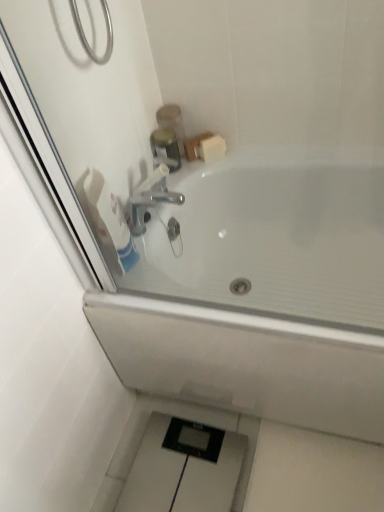
Question: Does white glossy bathtub at upper center appear on the right side of white matte toilet paper at upper left?

Choices:
 (A) no
 (B) yes

Answer: (B)

Question: Is white glossy bathtub at upper center oriented away from white matte toilet paper at upper left?

Choices:
 (A) yes
 (B) no

Answer: (B)

Question: Is white glossy bathtub at upper center outside white matte toilet paper at upper left?

Choices:
 (A) yes
 (B) no

Answer: (A)

Question: Does white glossy bathtub at upper center have a greater width compared to white matte toilet paper at upper left?

Choices:
 (A) no
 (B) yes

Answer: (B)

Question: From a real-world perspective, is white glossy bathtub at upper center positioned over white matte toilet paper at upper left based on gravity?

Choices:
 (A) yes
 (B) no

Answer: (B)

Question: Is white glossy bathtub at upper center shorter than white matte toilet paper at upper left?

Choices:
 (A) yes
 (B) no

Answer: (B)

Question: Considering the relative sizes of brushed metal faucet at upper center and white matte toilet paper at upper left in the image provided, is brushed metal faucet at upper center wider than white matte toilet paper at upper left?

Choices:
 (A) yes
 (B) no

Answer: (A)

Question: Considering the relative positions of brushed metal faucet at upper center and white matte toilet paper at upper left in the image provided, is brushed metal faucet at upper center in front of white matte toilet paper at upper left?

Choices:
 (A) no
 (B) yes

Answer: (A)

Question: Is brushed metal faucet at upper center at the left side of white matte toilet paper at upper left?

Choices:
 (A) no
 (B) yes

Answer: (A)

Question: From a real-world perspective, does brushed metal faucet at upper center stand above white matte toilet paper at upper left?

Choices:
 (A) no
 (B) yes

Answer: (A)

Question: Considering the relative sizes of brushed metal faucet at upper center and white matte toilet paper at upper left in the image provided, is brushed metal faucet at upper center shorter than white matte toilet paper at upper left?

Choices:
 (A) no
 (B) yes

Answer: (B)

Question: Does brushed metal faucet at upper center have a smaller size compared to white matte toilet paper at upper left?

Choices:
 (A) no
 (B) yes

Answer: (B)

Question: From a real-world perspective, is white matte soap at upper right below brushed metal soap dispenser at upper center?

Choices:
 (A) yes
 (B) no

Answer: (A)